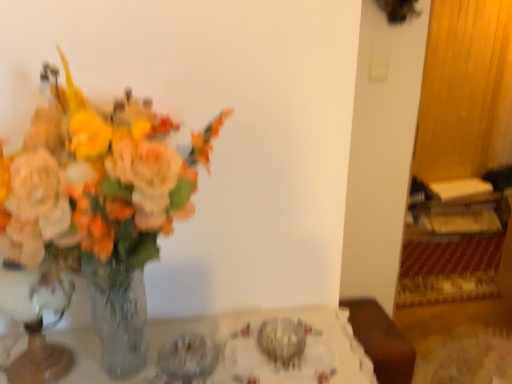
Question: Considering the positions of translucent glass vase at left and clear glass vase at left in the image, is translucent glass vase at left bigger or smaller than clear glass vase at left?

Choices:
 (A) small
 (B) big

Answer: (B)

Question: From a real-world perspective, relative to clear glass vase at left, is translucent glass vase at left vertically above or below?

Choices:
 (A) above
 (B) below

Answer: (A)

Question: Which object is the farthest from the translucent glass vase at left?

Choices:
 (A) clear glass vase at left
 (B) clear glass vase at left

Answer: (A)

Question: Estimate the real-world distances between objects in this image. Which object is closer to the clear glass vase at left?

Choices:
 (A) clear glass vase at left
 (B) translucent glass vase at left

Answer: (A)